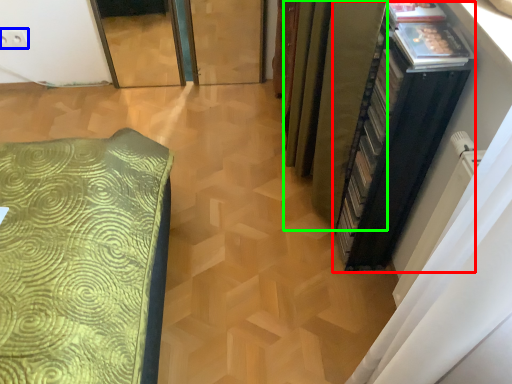
Question: Which object is positioned farthest from file cabinet (highlighted by a red box)? Select from electric outlet (highlighted by a blue box) and curtain (highlighted by a green box).

Choices:
 (A) electric outlet
 (B) curtain

Answer: (A)